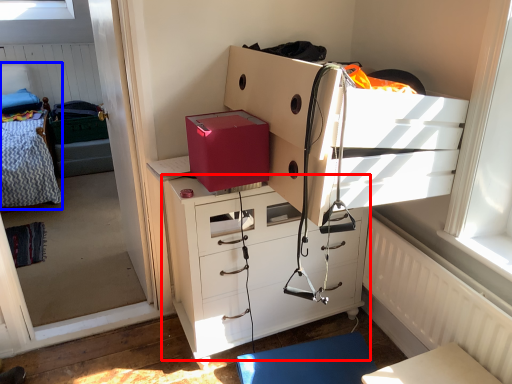
Question: Among these objects, which one is nearest to the camera, chest of drawers (highlighted by a red box) or hospital bed (highlighted by a blue box)?

Choices:
 (A) chest of drawers
 (B) hospital bed

Answer: (A)